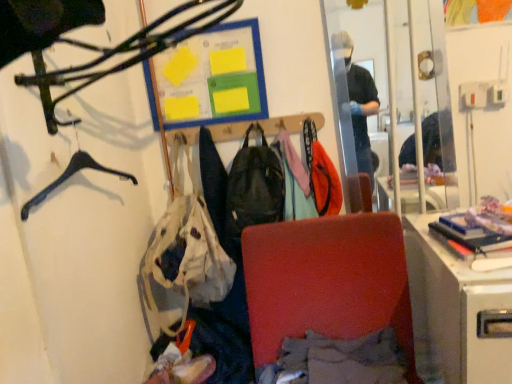
Question: From their relative heights in the image, would you say white fabric handbag at center is taller or shorter than clear glass mirror at upper right?

Choices:
 (A) short
 (B) tall

Answer: (A)

Question: Would you say white fabric handbag at center is inside or outside clear glass mirror at upper right?

Choices:
 (A) outside
 (B) inside

Answer: (A)

Question: Considering the real-world distances, which object is farthest from the white glossy desk at lower right?

Choices:
 (A) matte black hanger at upper left
 (B) matte black backpack at center
 (C) hardcover book at right
 (D) white fabric handbag at center
 (E) clear glass mirror at upper right

Answer: (A)

Question: Estimate the real-world distances between objects in this image. Which object is closer to the clear glass mirror at upper right?

Choices:
 (A) white fabric handbag at center
 (B) velvet red chair at center
 (C) matte black hanger at upper left
 (D) white glossy desk at lower right
 (E) hardcover book at right

Answer: (E)